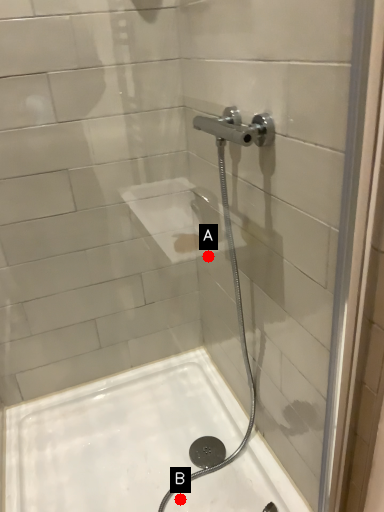
Question: Two points are circled on the image, labeled by A and B beside each circle. Which of the following is the farthest from the observer?

Choices:
 (A) A is further
 (B) B is further

Answer: (B)